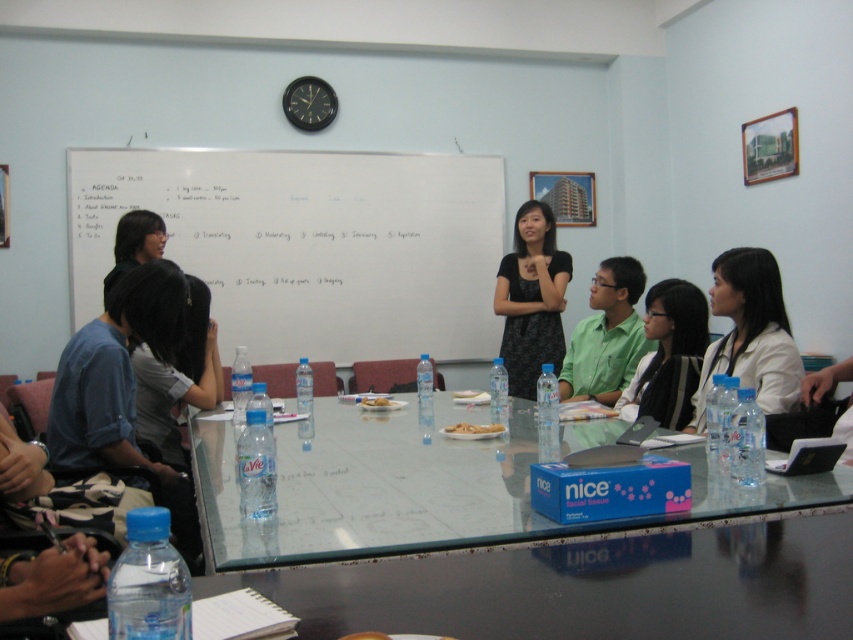
You are a participant in the meeting and need to adjust your seating to face the whiteboard. Which object, the black glossy hair at center or the green matte shirt at center, is closer to the whiteboard?

The black glossy hair at center is closer to the whiteboard because it is shorter than the green matte shirt at center.